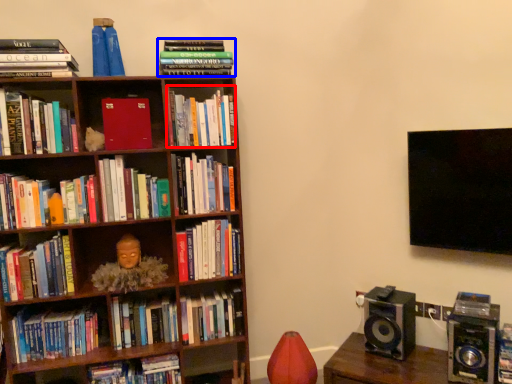
Question: Which point is further to the camera, book (highlighted by a red box) or book (highlighted by a blue box)?

Choices:
 (A) book
 (B) book

Answer: (A)